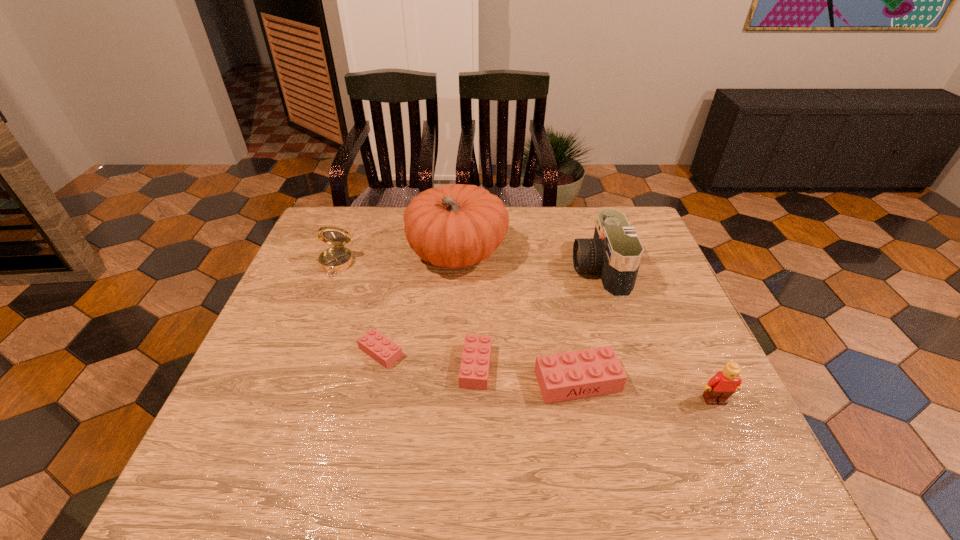
Point out which Lego is positioned as the nearest to the fifth tallest object. Please provide its 2D coordinates. Your answer should be formatted as a tuple, i.e. [(x, y)], where the tuple contains the x and y coordinates of a point satisfying the conditions above.

[(474, 370)]

Identify which Lego is located as the second nearest to the leftmost Lego. Please provide its 2D coordinates. Your answer should be formatted as a tuple, i.e. [(x, y)], where the tuple contains the x and y coordinates of a point satisfying the conditions above.

[(572, 375)]

Locate an element on the screen. free location that satisfies the following two spatial constraints: 1. on the front side of the leftmost Lego; 2. on the right side of the fifth tallest object is located at coordinates (374, 381).

Locate an element on the screen. The width and height of the screenshot is (960, 540). free location that satisfies the following two spatial constraints: 1. with the dial facing the shortest object; 2. on the right side of the compass is located at coordinates (302, 352).

Where is `free space in the image that satisfies the following two spatial constraints: 1. on the back side of the pumpkin; 2. on the left side of the shortest Lego`? This screenshot has height=540, width=960. free space in the image that satisfies the following two spatial constraints: 1. on the back side of the pumpkin; 2. on the left side of the shortest Lego is located at coordinates (402, 253).

This screenshot has height=540, width=960. In order to click on vacant area in the image that satisfies the following two spatial constraints: 1. on the front side of the shortest Lego; 2. on the right side of the second Lego from right to left in this screenshot , I will do `click(374, 381)`.